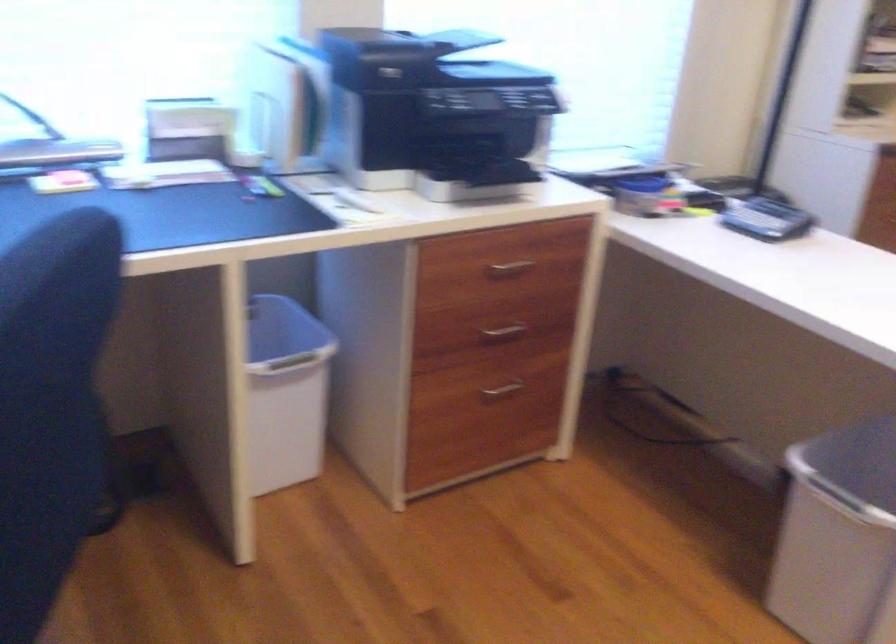
The width and height of the screenshot is (896, 644). What do you see at coordinates (281, 328) in the screenshot? I see `a blue trash can rim` at bounding box center [281, 328].